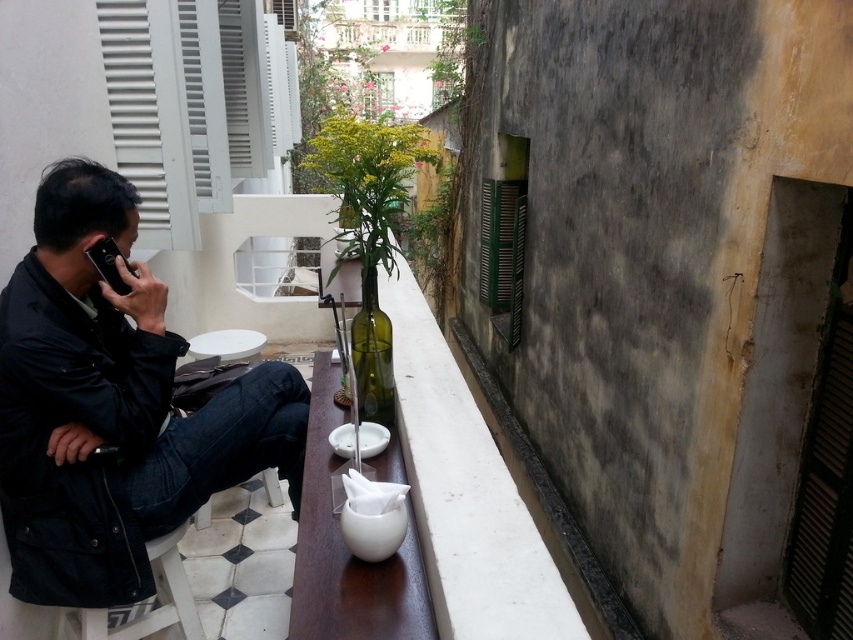
Question: Is black matte jacket at left to the left of white glossy table at center from the viewer's perspective?

Choices:
 (A) yes
 (B) no

Answer: (B)

Question: Does black matte jacket at left lie in front of white glossy table at center?

Choices:
 (A) no
 (B) yes

Answer: (B)

Question: Can you confirm if black matte jacket at left is thinner than white concrete ledge at center?

Choices:
 (A) no
 (B) yes

Answer: (A)

Question: Which object is farther from the camera taking this photo?

Choices:
 (A) white concrete ledge at center
 (B) black matte jacket at left
 (C) white plastic stool at lower left
 (D) white glossy table at center

Answer: (D)

Question: Which object is closer to the camera taking this photo?

Choices:
 (A) white glossy table at center
 (B) black matte jacket at left
 (C) white plastic stool at lower left
 (D) white concrete ledge at center

Answer: (D)

Question: Which object is positioned farthest from the white concrete ledge at center?

Choices:
 (A) white plastic stool at lower left
 (B) white glossy table at center

Answer: (B)